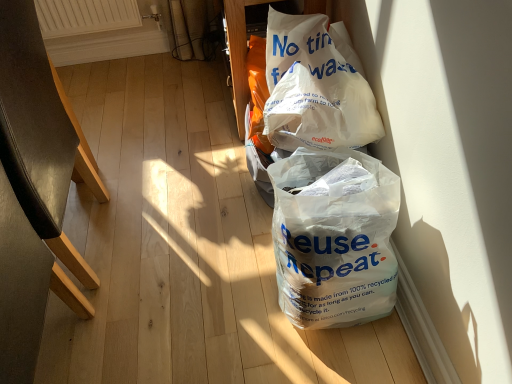
Where is `vacant space in white textured radiator at upper left (from a real-world perspective)`? The width and height of the screenshot is (512, 384). vacant space in white textured radiator at upper left (from a real-world perspective) is located at coordinates (113, 63).